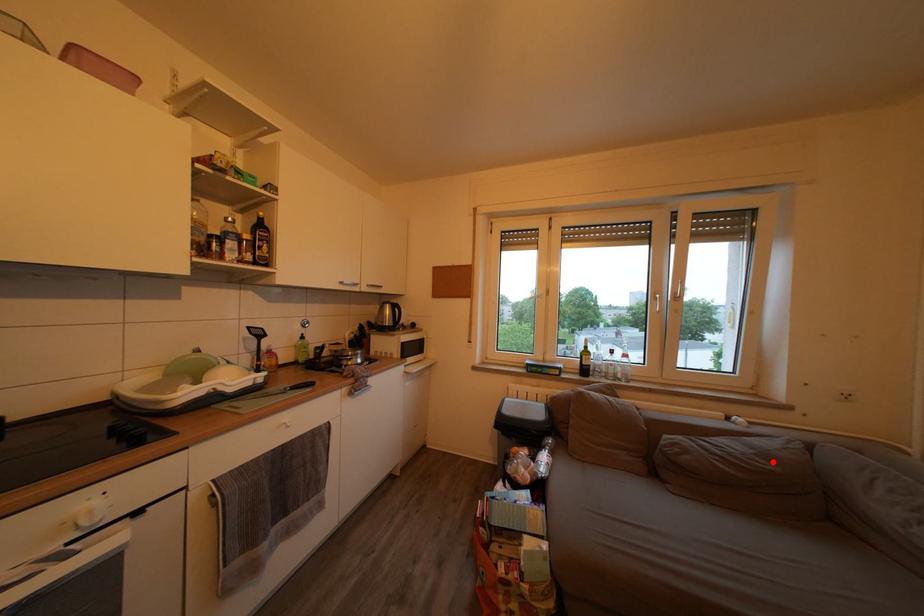
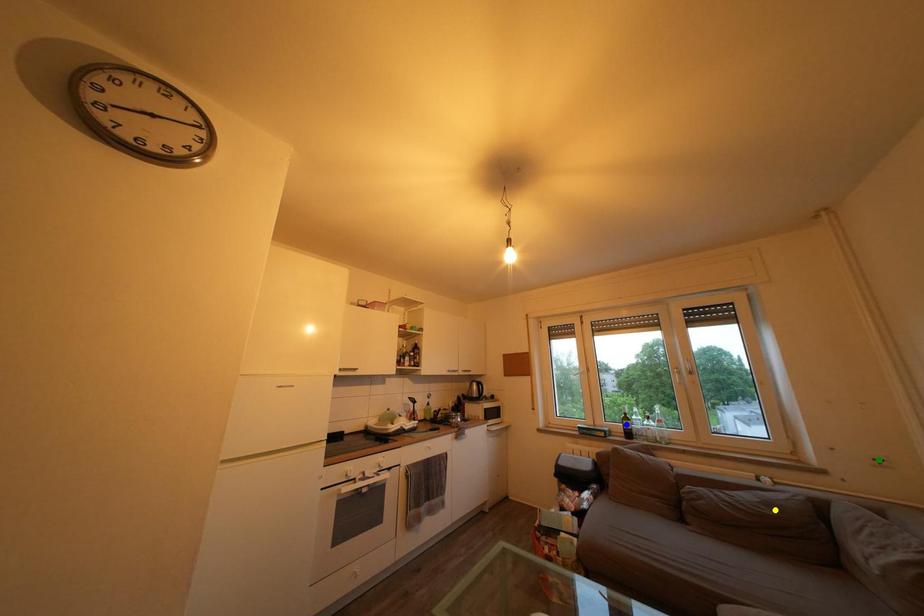
Question: I am providing you with two images of the same scene from different viewpoints. A red point is marked on the first image. You are given multiple points on the second image. Can you choose the point in image 2 that corresponds to the point in image 1?

Choices:
 (A) blue point
 (B) green point
 (C) yellow point

Answer: (C)